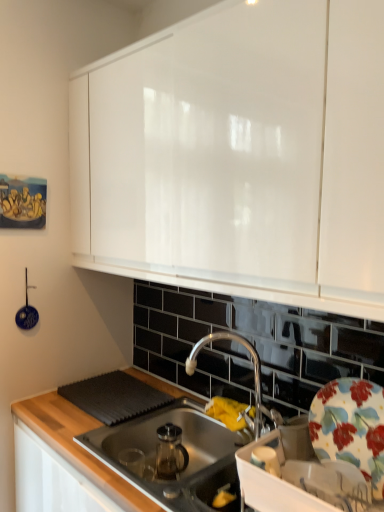
This screenshot has width=384, height=512. Describe the element at coordinates (180, 446) in the screenshot. I see `stainless steel sink at center` at that location.

Where is `floral ceramic plate at right`? The width and height of the screenshot is (384, 512). floral ceramic plate at right is located at coordinates (351, 426).

At what (x,y) coordinates should I click in order to perform the action: click on blue ceramic ladle at left. Please return your answer as a coordinate pair (x, y). Looking at the image, I should click on (27, 311).

Find the location of a particular element. This screenshot has height=512, width=384. chrome metallic faucet at center is located at coordinates (254, 376).

Identify the location of stainless steel sink at center. The image size is (384, 512). (180, 446).

Is chrome metallic faucet at center at the back of stainless steel sink at center?

stainless steel sink at center does not have its back to chrome metallic faucet at center.

From the image's perspective, is stainless steel sink at center positioned above or below chrome metallic faucet at center?

Clearly, from the image's perspective, stainless steel sink at center is below chrome metallic faucet at center.

Does point (152, 455) come closer to viewer compared to point (194, 348)?

Yes, point (152, 455) is closer to viewer.

The width and height of the screenshot is (384, 512). What are the coordinates of `tap above the stainless steel sink at center (from the image's perspective)` in the screenshot? It's located at (254, 376).

The image size is (384, 512). I want to click on appliance behind the stainless steel sink at center, so click(27, 311).

Is blue ceramic ladle at left smaller than stainless steel sink at center?

Correct, blue ceramic ladle at left occupies less space than stainless steel sink at center.

Is blue ceramic ladle at left looking in the opposite direction of stainless steel sink at center?

No, blue ceramic ladle at left is not facing away from stainless steel sink at center.

From the image's perspective, which is below, blue ceramic ladle at left or stainless steel sink at center?

stainless steel sink at center.

Who is taller, blue ceramic ladle at left or floral ceramic plate at right?

Standing taller between the two is blue ceramic ladle at left.

Is blue ceramic ladle at left turned away from floral ceramic plate at right?

No, blue ceramic ladle at left is not facing away from floral ceramic plate at right.

From a real-world perspective, relative to floral ceramic plate at right, is blue ceramic ladle at left vertically above or below?

Clearly, from a real-world perspective, blue ceramic ladle at left is above floral ceramic plate at right.

Is floral ceramic plate at right inside blue ceramic ladle at left?

No.

From the image's perspective, which is below, blue ceramic ladle at left or chrome metallic faucet at center?

chrome metallic faucet at center, from the image's perspective.

In the image, is blue ceramic ladle at left positioned in front of or behind chrome metallic faucet at center?

In the image, blue ceramic ladle at left appears behind chrome metallic faucet at center.

Is blue ceramic ladle at left to the right of chrome metallic faucet at center from the viewer's perspective?

No.

Considering the sizes of objects stainless steel sink at center and blue ceramic ladle at left in the image provided, who is wider, stainless steel sink at center or blue ceramic ladle at left?

Wider between the two is stainless steel sink at center.

Based on the photo, from a real-world perspective, which object rests below the other?

From a 3D spatial view, stainless steel sink at center is below.

In terms of size, does stainless steel sink at center appear bigger or smaller than blue ceramic ladle at left?

Clearly, stainless steel sink at center is larger in size than blue ceramic ladle at left.

Where is `sink below the blue ceramic ladle at left (from a real-world perspective)`? The height and width of the screenshot is (512, 384). sink below the blue ceramic ladle at left (from a real-world perspective) is located at coordinates (180, 446).

Are blue ceramic ladle at left and white glossy cabinet at upper center far apart?

Actually, blue ceramic ladle at left and white glossy cabinet at upper center are a little close together.

Considering the positions of objects blue ceramic ladle at left and white glossy cabinet at upper center in the image provided, who is more to the left, blue ceramic ladle at left or white glossy cabinet at upper center?

From the viewer's perspective, blue ceramic ladle at left appears more on the left side.

Considering the sizes of objects blue ceramic ladle at left and white glossy cabinet at upper center in the image provided, who is bigger, blue ceramic ladle at left or white glossy cabinet at upper center?

white glossy cabinet at upper center.

Can you confirm if blue ceramic ladle at left is thinner than white glossy cabinet at upper center?

Indeed, blue ceramic ladle at left has a lesser width compared to white glossy cabinet at upper center.

Does chrome metallic faucet at center lie in front of floral ceramic plate at right?

No, chrome metallic faucet at center is further to the viewer.

Considering the sizes of objects chrome metallic faucet at center and floral ceramic plate at right in the image provided, who is shorter, chrome metallic faucet at center or floral ceramic plate at right?

floral ceramic plate at right.

Looking at this image, how many degrees apart are the facing directions of chrome metallic faucet at center and floral ceramic plate at right?

They differ by 54.7 degrees in their facing directions.

The image size is (384, 512). Identify the location of tap that is behind the stainless steel sink at center. (254, 376).

You are a GUI agent. You are given a task and a screenshot of the screen. Output one action in this format:
    pyautogui.click(x=<x>, y=<y>)
    Task: Click on the sink beneath the blue ceramic ladle at left (from a real-world perspective)
    This screenshot has width=384, height=512.
    Given the screenshot: What is the action you would take?
    pyautogui.click(x=180, y=446)

Looking at the image, which one is located further to white glossy cabinet at upper center, floral ceramic plate at right or stainless steel sink at center?

stainless steel sink at center lies further to white glossy cabinet at upper center than the other object.

Looking at the image, which one is located closer to chrome metallic faucet at center, stainless steel sink at center or floral ceramic plate at right?

The object closer to chrome metallic faucet at center is stainless steel sink at center.

From the image, which object appears to be nearer to white glossy cabinet at upper center, floral ceramic plate at right or blue ceramic ladle at left?

floral ceramic plate at right.

When comparing their distances from chrome metallic faucet at center, does stainless steel sink at center or blue ceramic ladle at left seem closer?

The object closer to chrome metallic faucet at center is stainless steel sink at center.

Based on their spatial positions, is floral ceramic plate at right or stainless steel sink at center closer to chrome metallic faucet at center?

Among the two, stainless steel sink at center is located nearer to chrome metallic faucet at center.

In the scene shown: Looking at the image, which one is located closer to white glossy cabinet at upper center, blue ceramic ladle at left or floral ceramic plate at right?

floral ceramic plate at right is closer to white glossy cabinet at upper center.

Based on the photo, based on their spatial positions, is stainless steel sink at center or white glossy cabinet at upper center closer to chrome metallic faucet at center?

Among the two, stainless steel sink at center is located nearer to chrome metallic faucet at center.

Looking at this image, based on their spatial positions, is white glossy cabinet at upper center or stainless steel sink at center closer to chrome metallic faucet at center?

stainless steel sink at center is positioned closer to the anchor chrome metallic faucet at center.

Locate an element on the screen. Image resolution: width=384 pixels, height=512 pixels. plate between white glossy cabinet at upper center and stainless steel sink at center vertically is located at coordinates (351, 426).

Where is `cabinetry between blue ceramic ladle at left and chrome metallic faucet at center from left to right`? The image size is (384, 512). cabinetry between blue ceramic ladle at left and chrome metallic faucet at center from left to right is located at coordinates (238, 155).

Locate an element on the screen. sink between blue ceramic ladle at left and floral ceramic plate at right is located at coordinates tap(180, 446).

Find the location of `tap situated between blue ceramic ladle at left and floral ceramic plate at right from left to right`. tap situated between blue ceramic ladle at left and floral ceramic plate at right from left to right is located at coordinates (254, 376).